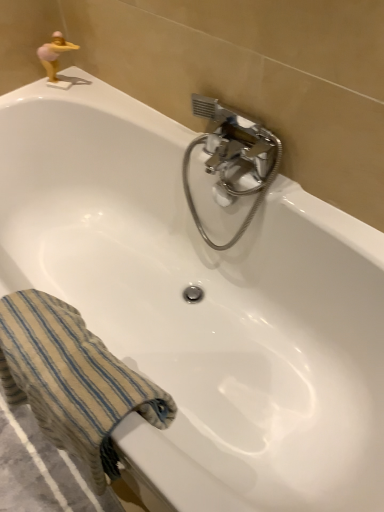
Question: From the image's perspective, relative to chrome metallic faucet at upper center, is gold plastic figurine at upper left above or below?

Choices:
 (A) below
 (B) above

Answer: (B)

Question: Looking at the image, does gold plastic figurine at upper left seem bigger or smaller compared to chrome metallic faucet at upper center?

Choices:
 (A) small
 (B) big

Answer: (A)

Question: Which object is the farthest from the beige striped towel at lower left?

Choices:
 (A) chrome metallic faucet at upper center
 (B) gold plastic figurine at upper left

Answer: (B)

Question: Based on their relative distances, which object is farther from the beige striped towel at lower left?

Choices:
 (A) gold plastic figurine at upper left
 (B) chrome metallic faucet at upper center

Answer: (A)